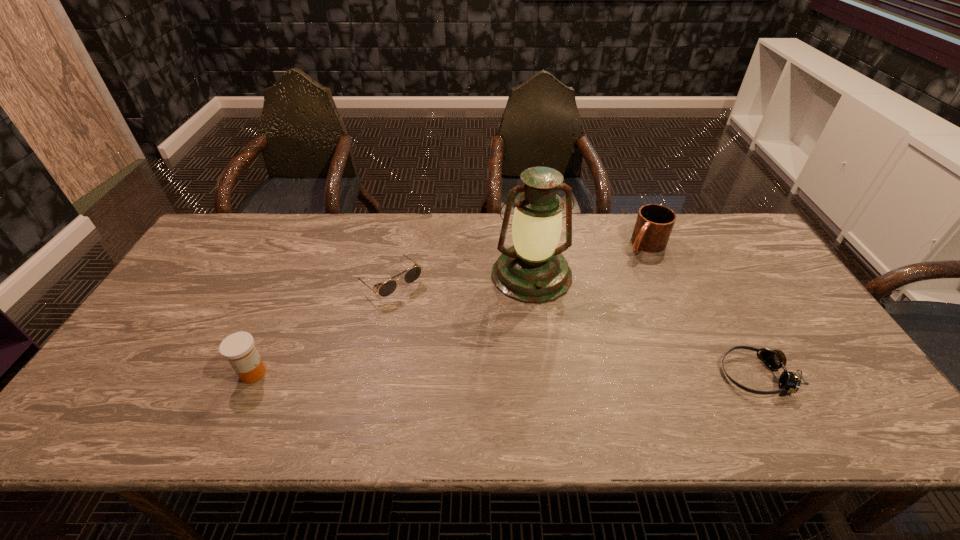
What are the coordinates of `vacant space located on the side of the mug with the handle` in the screenshot? It's located at (591, 300).

The height and width of the screenshot is (540, 960). I want to click on free region located 0.100m on the side of the mug with the handle, so click(620, 272).

The height and width of the screenshot is (540, 960). What are the coordinates of `lantern at the far edge` in the screenshot? It's located at (533, 270).

Identify the location of mug that is at the far edge. Image resolution: width=960 pixels, height=540 pixels. (654, 224).

You are a GUI agent. You are given a task and a screenshot of the screen. Output one action in this format:
    pyautogui.click(x=<x>, y=<y>)
    Task: Click on the medicine that is at the near edge
    
    Given the screenshot: What is the action you would take?
    pyautogui.click(x=238, y=348)

Find the location of a particular element. This screenshot has height=540, width=960. goggles at the near edge is located at coordinates (789, 381).

The width and height of the screenshot is (960, 540). In order to click on object that is positioned at the right edge in this screenshot , I will do `click(789, 381)`.

Find the location of a particular element. object present at the near right corner is located at coordinates (789, 381).

In order to click on free space at the far edge of the desktop in this screenshot , I will do `click(351, 252)`.

Identify the location of vacant space at the near edge. This screenshot has width=960, height=540. (372, 369).